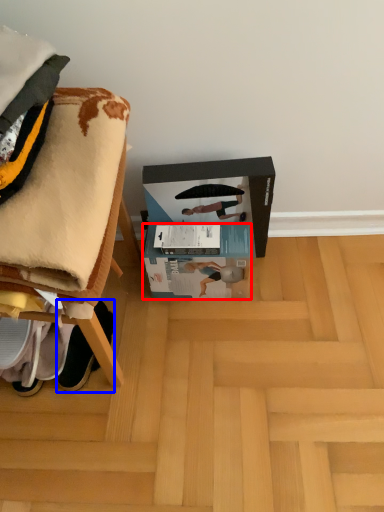
Question: Which object appears farthest to the camera in this image, box (highlighted by a red box) or footwear (highlighted by a blue box)?

Choices:
 (A) box
 (B) footwear

Answer: (A)